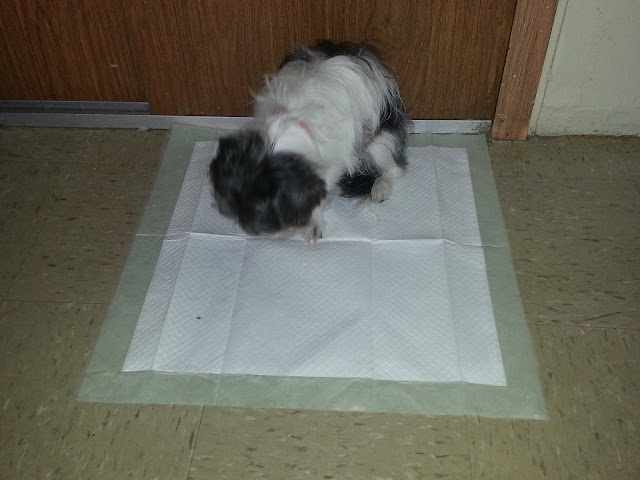
What are the coordinates of `wooden door` in the screenshot? It's located at (188, 50).